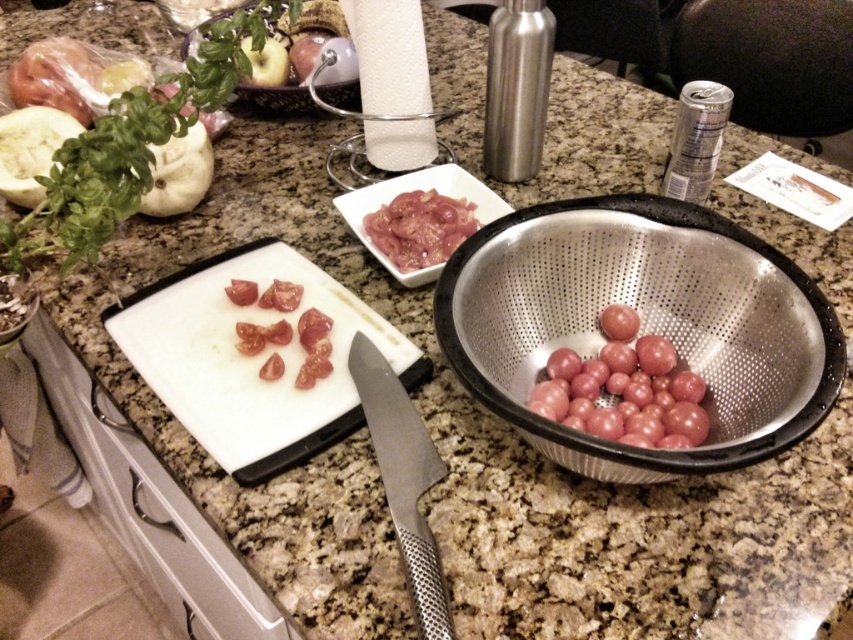
Question: Is glossy red tomato at center right to the left of matte white apple at upper left from the viewer's perspective?

Choices:
 (A) yes
 (B) no

Answer: (B)

Question: Which object is positioned farthest from the green leafy vegetable at upper left?

Choices:
 (A) matte white apple at upper left
 (B) pink glossy meat at center
 (C) green leafy basil at upper left
 (D) white plastic cutting board at lower left

Answer: (B)

Question: Which object is farther from the camera taking this photo?

Choices:
 (A) green matte squash at upper left
 (B) white plastic cutting board at lower left
 (C) green leafy basil at upper left
 (D) pink glossy meat at center

Answer: (C)

Question: Is green leafy vegetable at upper left closer to the viewer compared to glossy red tomato at center right?

Choices:
 (A) yes
 (B) no

Answer: (B)

Question: Does green leafy vegetable at upper left appear over pink glossy meat at center?

Choices:
 (A) yes
 (B) no

Answer: (A)

Question: Estimate the real-world distances between objects in this image. Which object is closer to the white plastic cutting board at lower left?

Choices:
 (A) green leafy basil at upper left
 (B) pink glossy meat at center

Answer: (B)